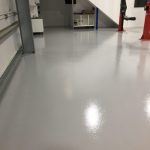
Find the location of a particular element. The image size is (150, 150). display case is located at coordinates (80, 18).